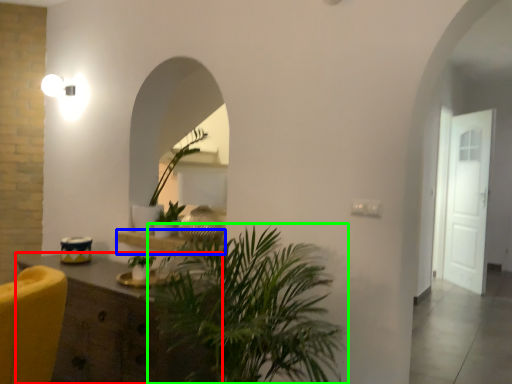
Question: Which is nearer to the cabinetry (highlighted by a red box)? shelf (highlighted by a blue box) or houseplant (highlighted by a green box).

Choices:
 (A) shelf
 (B) houseplant

Answer: (B)